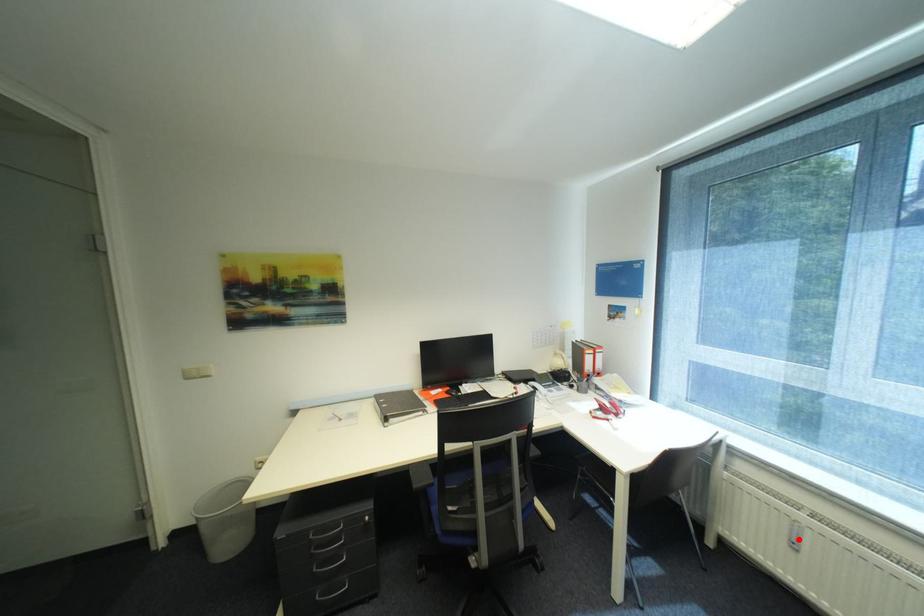
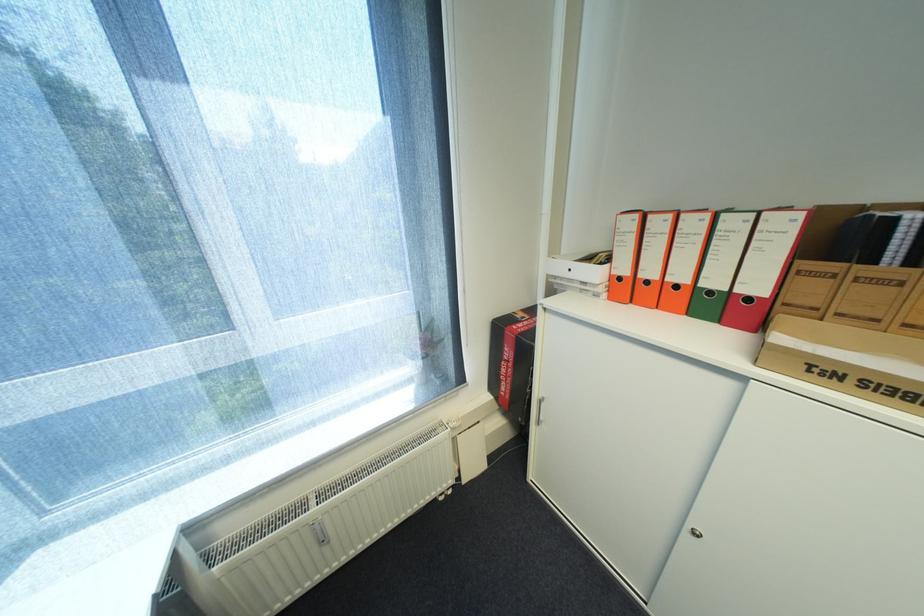
Question: I am providing you with two images of the same scene from different viewpoints. Image1 has a red point marked. In image2, the corresponding 3D location appears at what relative position? Reply with the corresponding letter.

Choices:
 (A) Closer
 (B) Farther

Answer: (A)